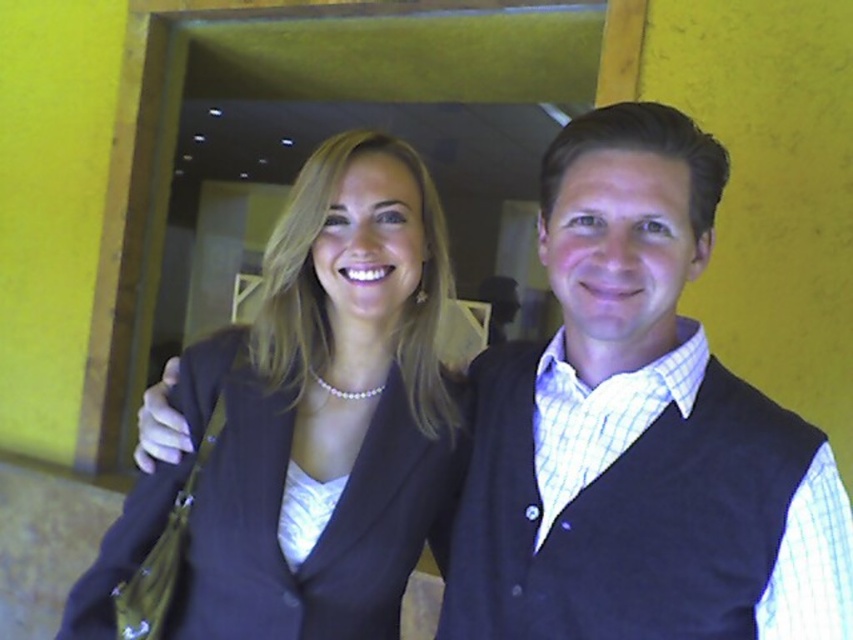
Question: From the image, what is the correct spatial relationship of matte black blazer at center in relation to dark blue wool vest at right?

Choices:
 (A) right
 (B) left

Answer: (B)

Question: Which point is closer to the camera?

Choices:
 (A) (579, 595)
 (B) (294, 600)

Answer: (A)

Question: Is dark blue wool vest at right bigger than white satin dress at center?

Choices:
 (A) yes
 (B) no

Answer: (A)

Question: Estimate the real-world distances between objects in this image. Which object is closer to the dark blue wool vest at right?

Choices:
 (A) matte black blazer at center
 (B) white satin dress at center

Answer: (A)

Question: Which point is closer to the camera taking this photo?

Choices:
 (A) click(x=426, y=406)
 (B) click(x=809, y=531)
 (C) click(x=308, y=504)

Answer: (B)

Question: Can you confirm if matte black blazer at center is positioned to the left of dark blue wool vest at right?

Choices:
 (A) yes
 (B) no

Answer: (A)